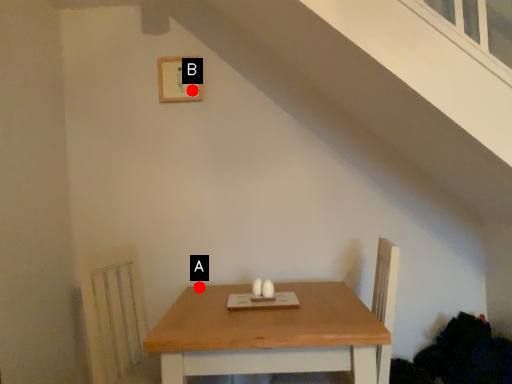
Question: Two points are circled on the image, labeled by A and B beside each circle. Which point appears farthest from the camera in this image?

Choices:
 (A) A is further
 (B) B is further

Answer: (B)